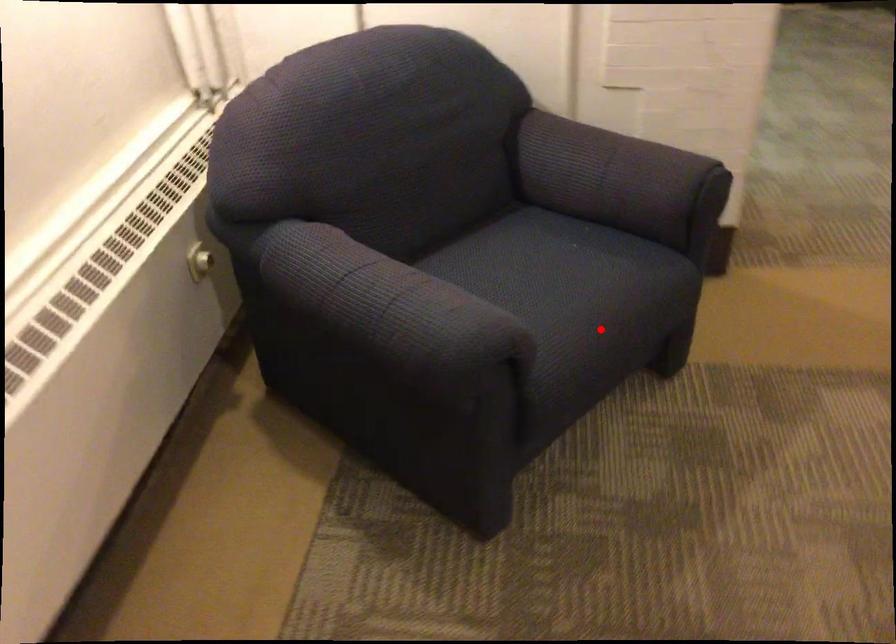
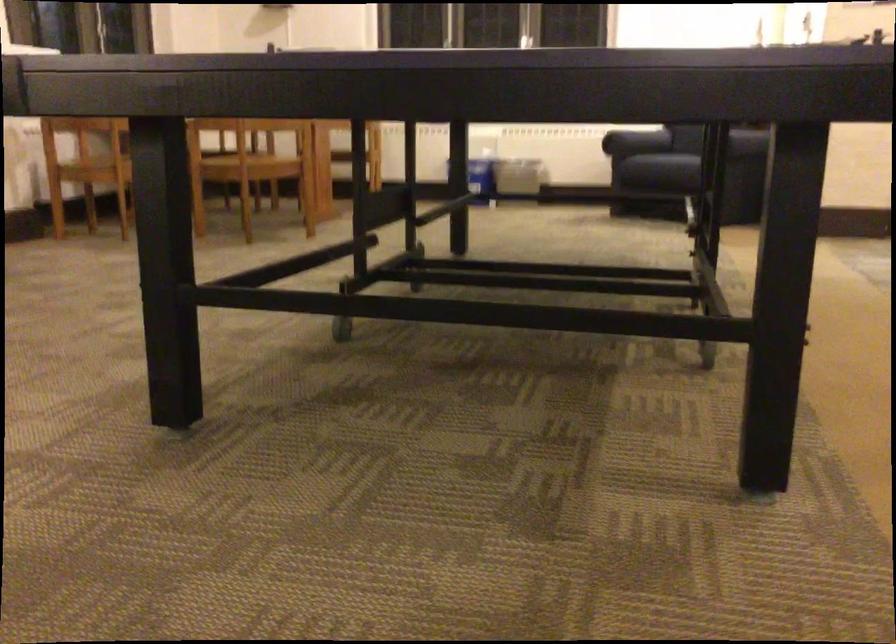
In the second image, find the point that corresponds to the highlighted location in the first image.

(633, 143)